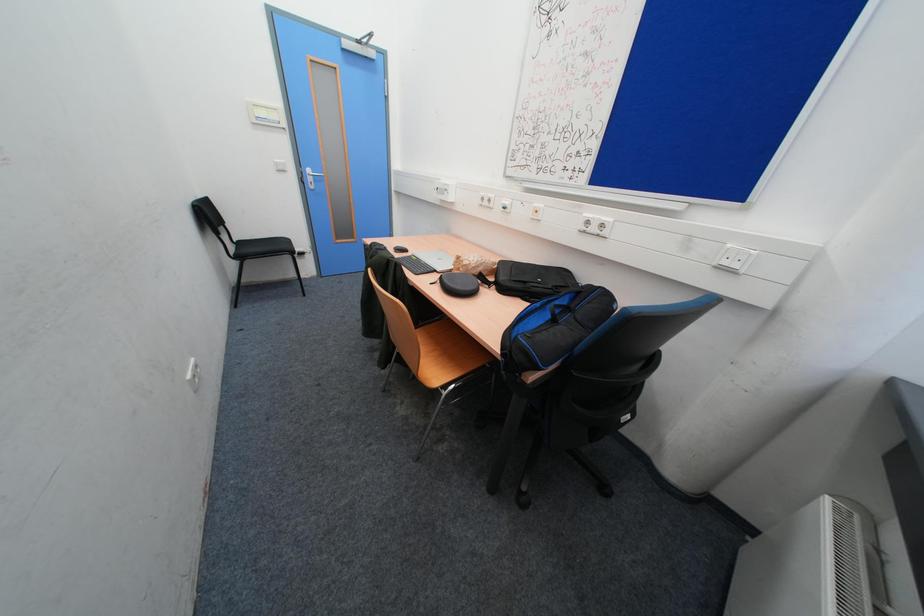
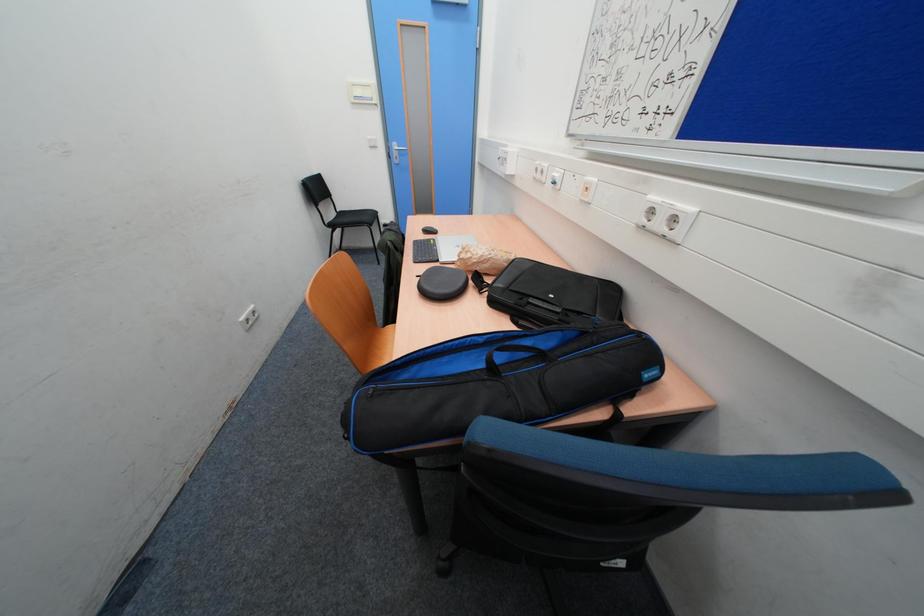
Question: Based on the continuous images, in which direction is the camera rotating? Reply with the corresponding letter.

Choices:
 (A) Left
 (B) Right
 (C) Up
 (D) Down

Answer: (A)